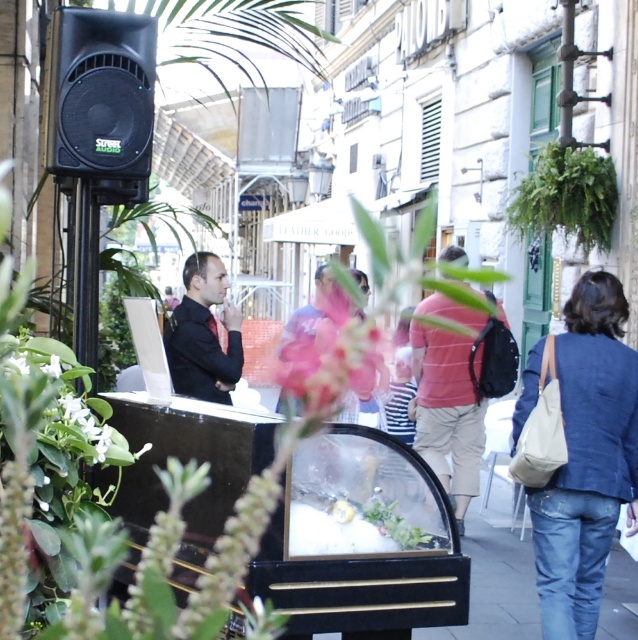
You are a florist who needs to place a new flower arrangement exactly at the center of the display case. The display case has coordinates from 0 to 1 on both axes. Where should you place the new arrangement to ensure it aligns with the pink matte flower at center?

The pink matte flower at center is located at point (313, 333), so you should place the new arrangement at those coordinates to align with it.

You are standing at the center of the street scene. There is a point marked at coordinates point (567, 196). What object is located at that point?

The point (567, 196) marks the green leafy plant at upper right.

You are standing at the point with coordinates point (56, 372) and want to walk towards the point with coordinates point (591, 150). Will the black speaker labeled Street Audio block your path?

Point (591, 150) is behind point (56, 372), so the black speaker labeled Street Audio will block your path.